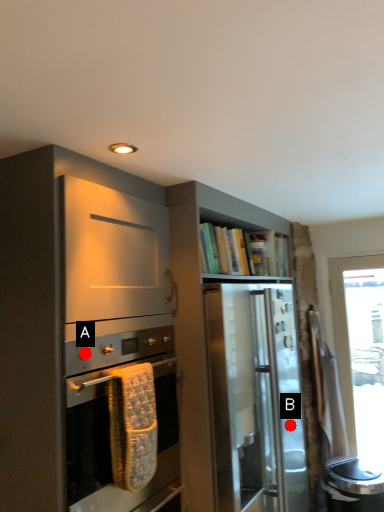
Question: Two points are circled on the image, labeled by A and B beside each circle. Which point is closer to the camera taking this photo?

Choices:
 (A) A is closer
 (B) B is closer

Answer: (A)